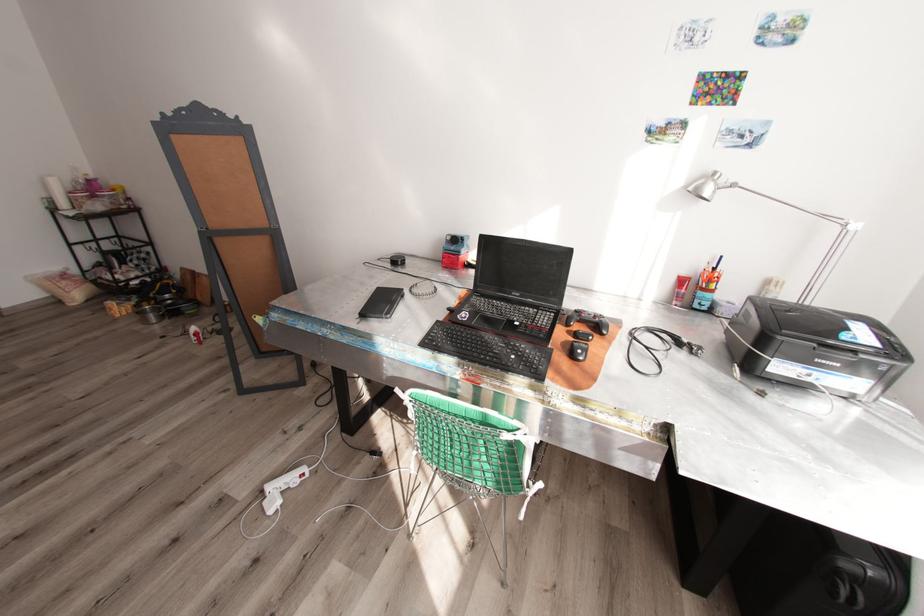
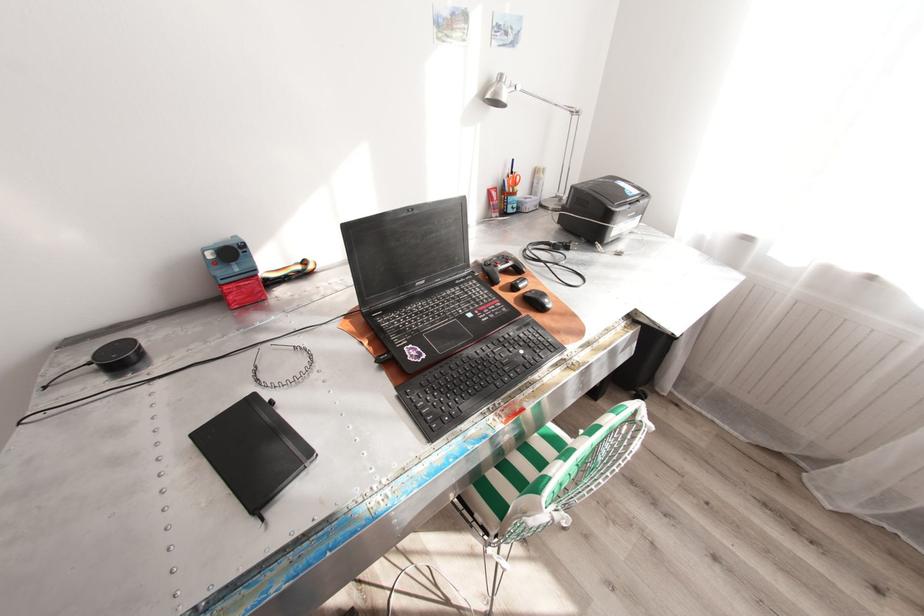
Find the pixel in the second image that matches pixel 454 238 in the first image.

(215, 254)